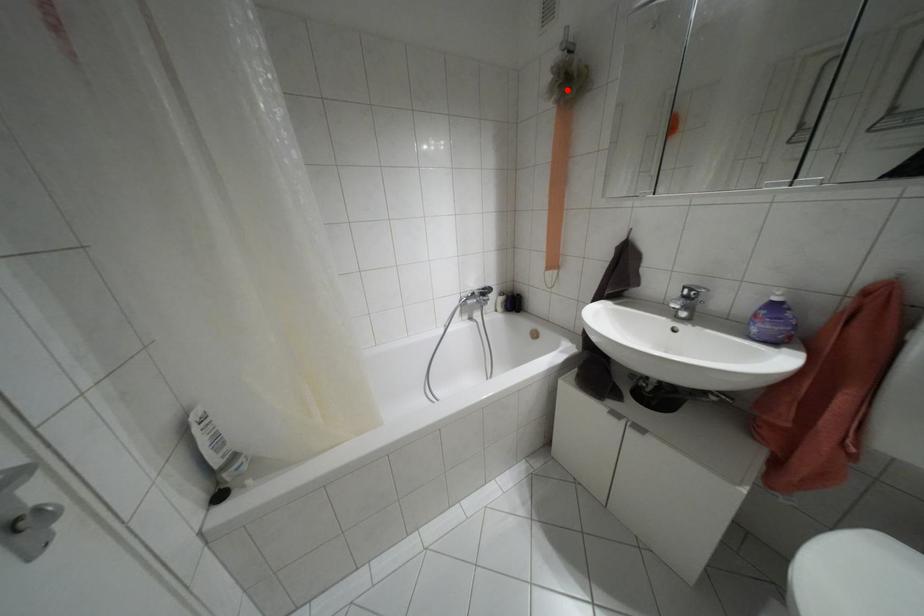
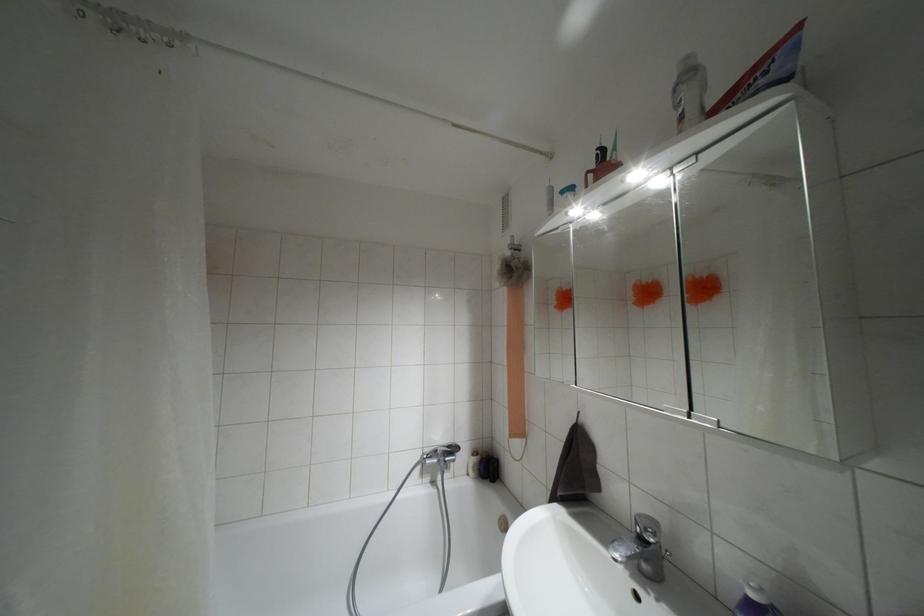
In the second image, find the point that corresponds to the highlighted location in the first image.

(509, 277)